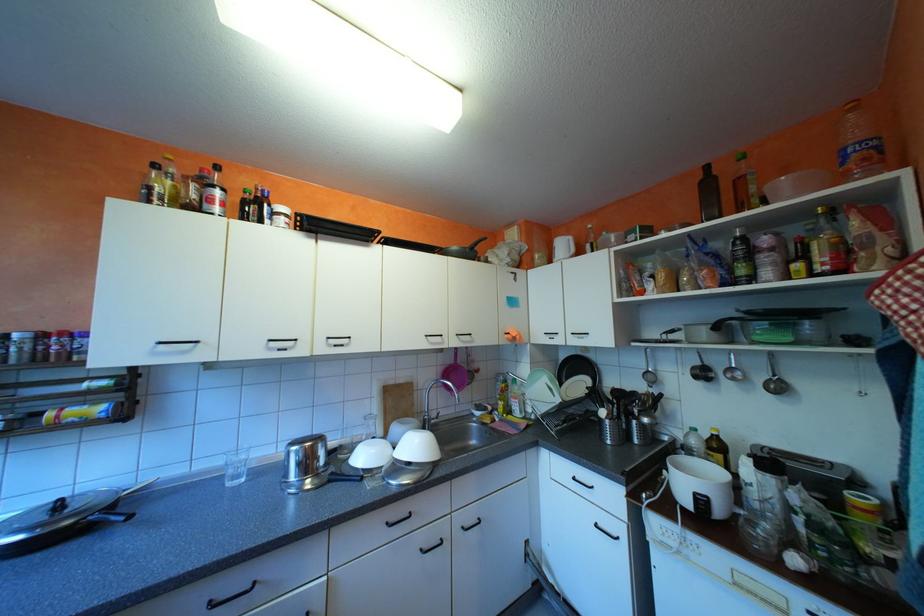
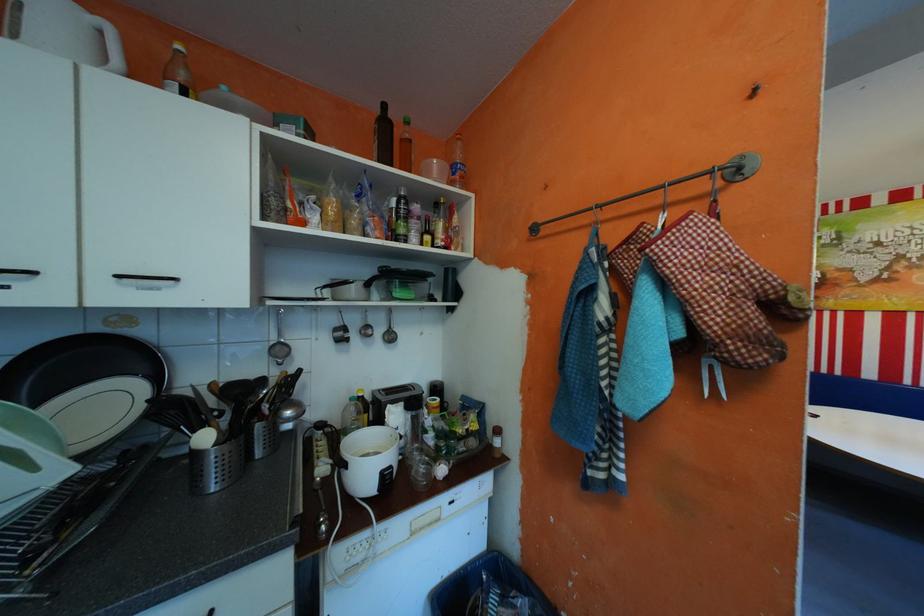
In the second image, find the point that corresponds to pixel 588 362 in the first image.

(105, 353)